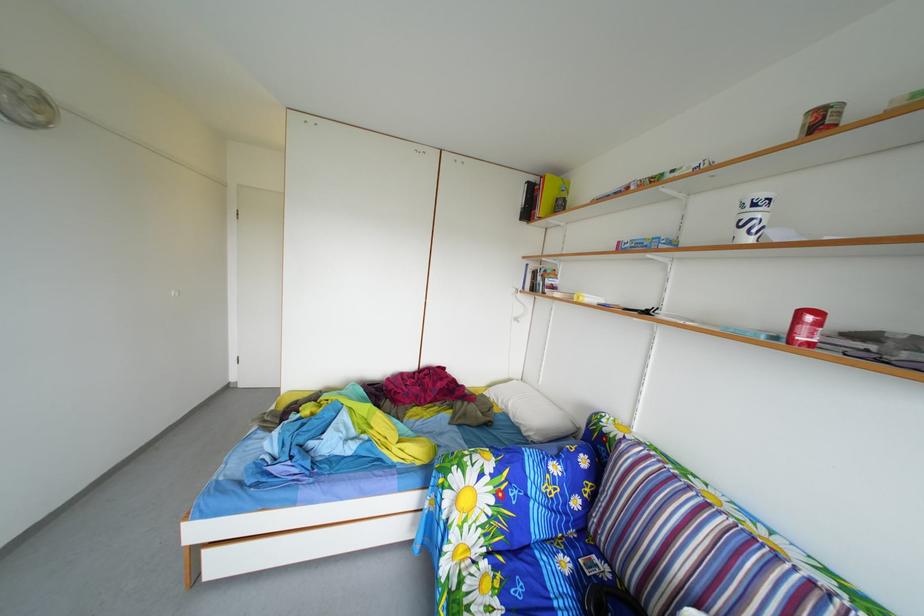
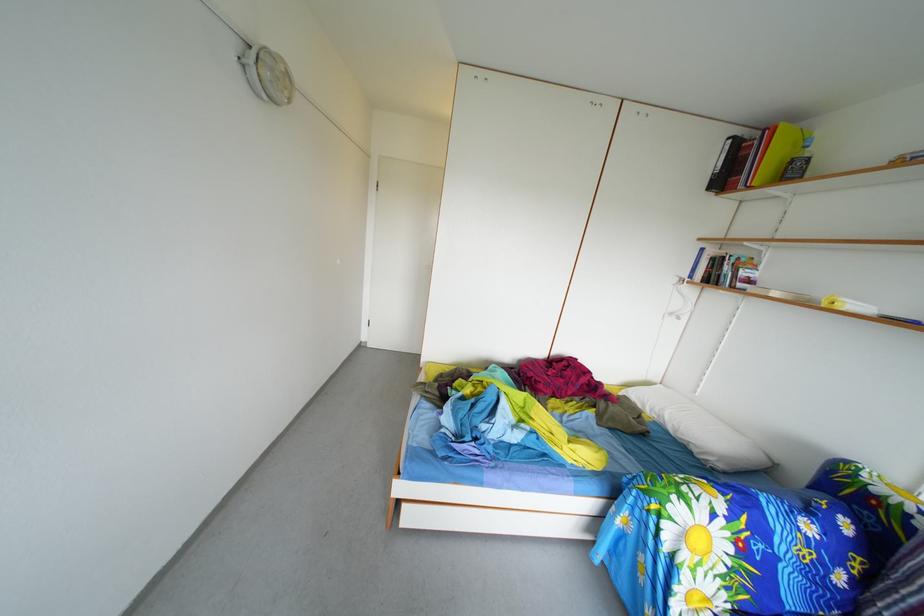
Question: The images are taken continuously from a first-person perspective. In which direction are you moving?

Choices:
 (A) Left
 (B) Right
 (C) Forward
 (D) Backward

Answer: (A)